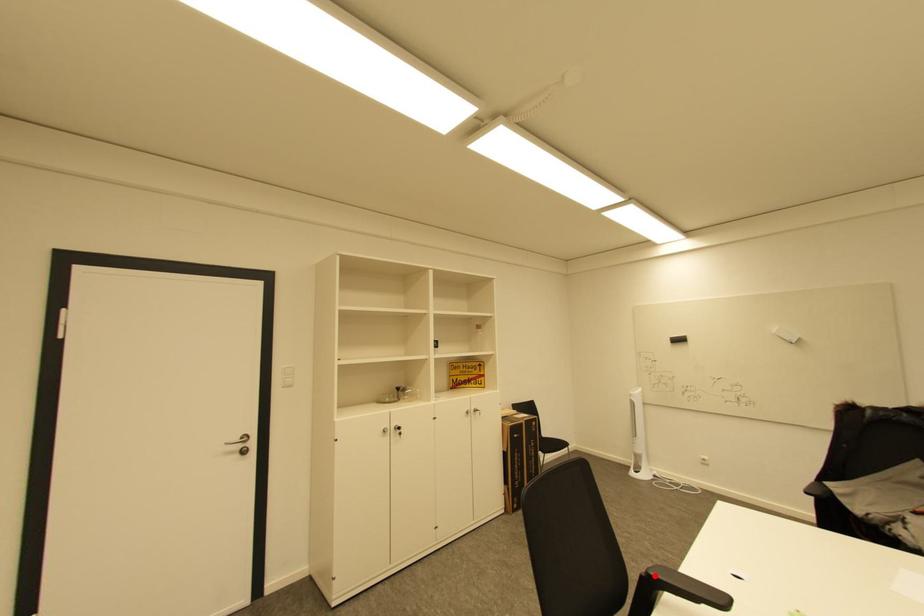
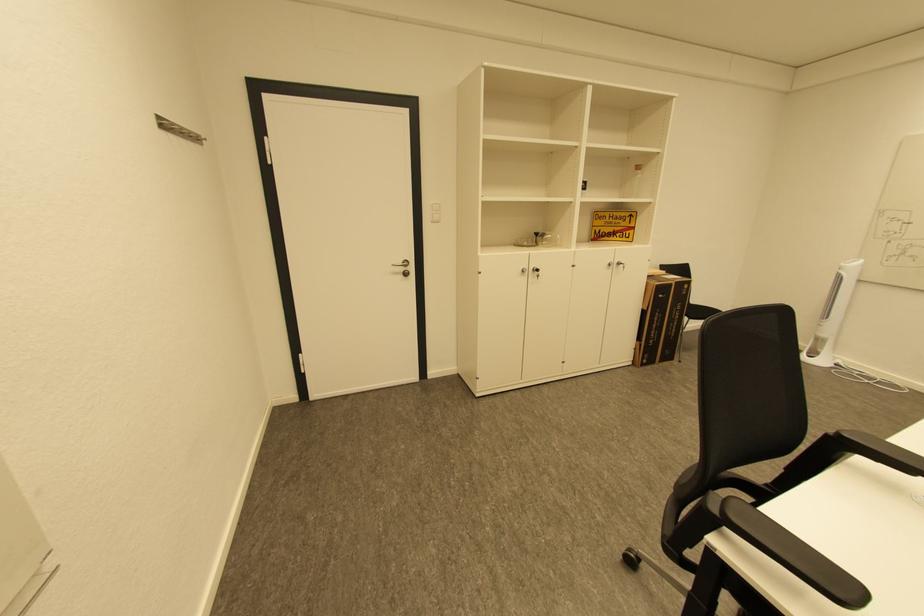
Locate, in the second image, the point that corresponds to the highlighted location in the first image.

(845, 436)